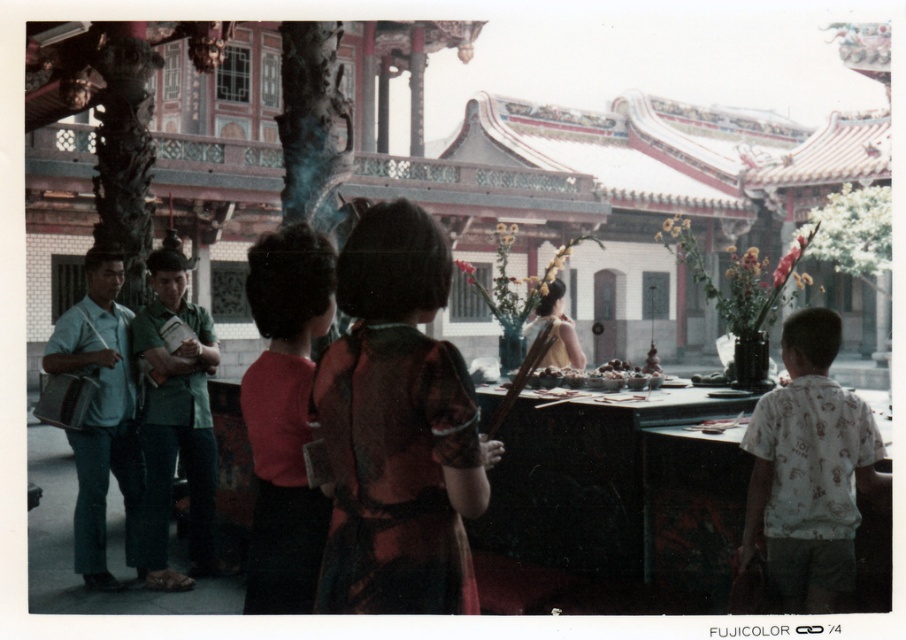
Is point (296, 508) positioned before point (152, 257)?

Yes.

Does point (249, 291) lie behind point (211, 499)?

No, it is in front of (211, 499).

Identify the location of red matte shirt at center. This screenshot has width=906, height=640. (285, 416).

Is matte brown dress at center shorter than white printed shirt at right?

Indeed, matte brown dress at center has a lesser height compared to white printed shirt at right.

Which is below, matte brown dress at center or white printed shirt at right?

matte brown dress at center is below.

Between point (423, 419) and point (770, 536), which one is positioned behind?

The point (770, 536) is behind.

This screenshot has height=640, width=906. What are the coordinates of `matte brown dress at center` in the screenshot? It's located at (397, 428).

Which is behind, point (338, 474) or point (193, 451)?

The point (193, 451) is behind.

Is matte brown dress at center further to the viewer compared to green fabric shirt at center?

No, matte brown dress at center is in front of green fabric shirt at center.

Is point (357, 312) positioned before point (201, 332)?

Yes, it is.

The height and width of the screenshot is (640, 906). I want to click on matte brown dress at center, so click(397, 428).